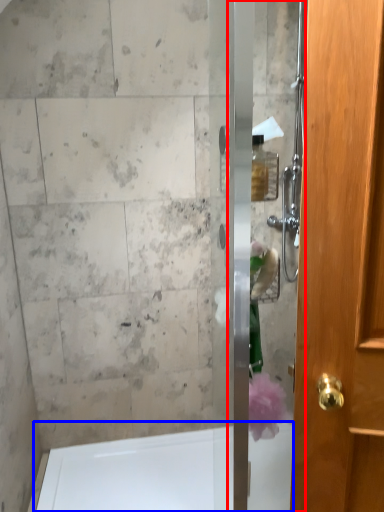
Question: Which object appears closest to the camera in this image, screen door (highlighted by a red box) or bath (highlighted by a blue box)?

Choices:
 (A) screen door
 (B) bath

Answer: (A)